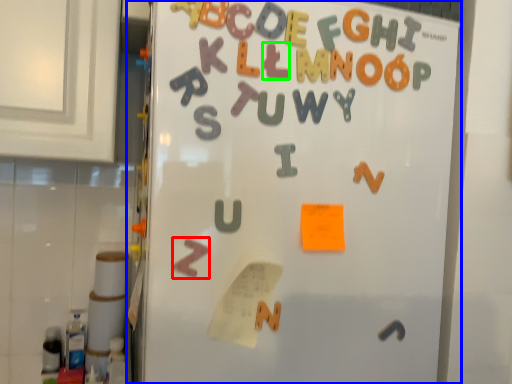
Question: Considering the real-world distances, which object is farthest from alphabet (highlighted by a red box)? refrigerator (highlighted by a blue box) or letter (highlighted by a green box)?

Choices:
 (A) refrigerator
 (B) letter

Answer: (B)